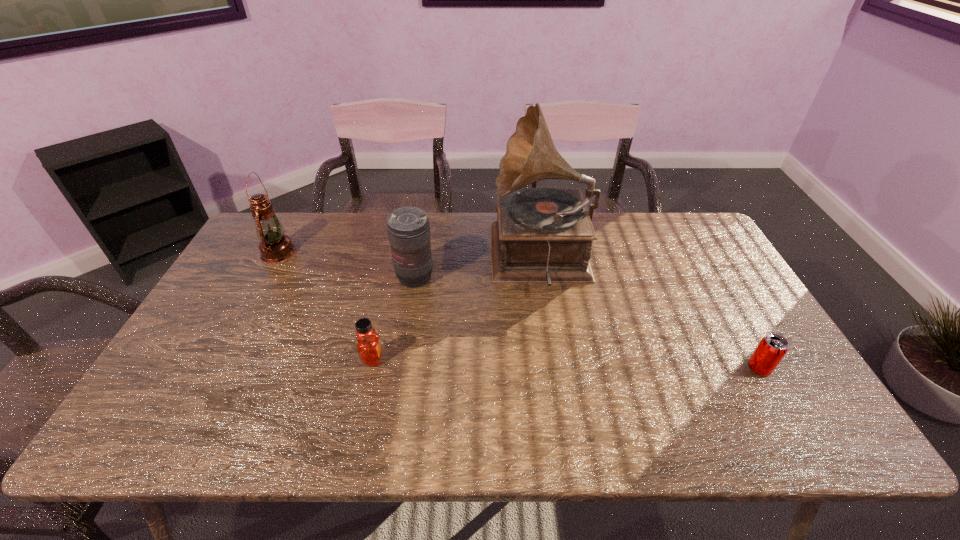
Where is `free space that satisfies the following two spatial constraints: 1. from the horn of the shortest object; 2. on the left side of the tallest object`? The image size is (960, 540). free space that satisfies the following two spatial constraints: 1. from the horn of the shortest object; 2. on the left side of the tallest object is located at coordinates (559, 369).

This screenshot has height=540, width=960. I want to click on blank space that satisfies the following two spatial constraints: 1. from the horn of the fourth object from left to right; 2. on the side of the third shortest object where the control switches are located, so click(544, 278).

Where is `free region that satisfies the following two spatial constraints: 1. on the side of the shortest object where the control switches are located; 2. on the right side of the third shortest object`? This screenshot has height=540, width=960. free region that satisfies the following two spatial constraints: 1. on the side of the shortest object where the control switches are located; 2. on the right side of the third shortest object is located at coordinates (400, 369).

At what (x,y) coordinates should I click in order to perform the action: click on free space that satisfies the following two spatial constraints: 1. from the horn of the tallest object; 2. on the side of the telephoto lens where the control switches are located. Please return your answer as a coordinate pair (x, y). The height and width of the screenshot is (540, 960). Looking at the image, I should click on (544, 278).

Identify the location of free space that satisfies the following two spatial constraints: 1. from the horn of the tallest object; 2. on the side of the third shortest object where the control switches are located. (544, 278).